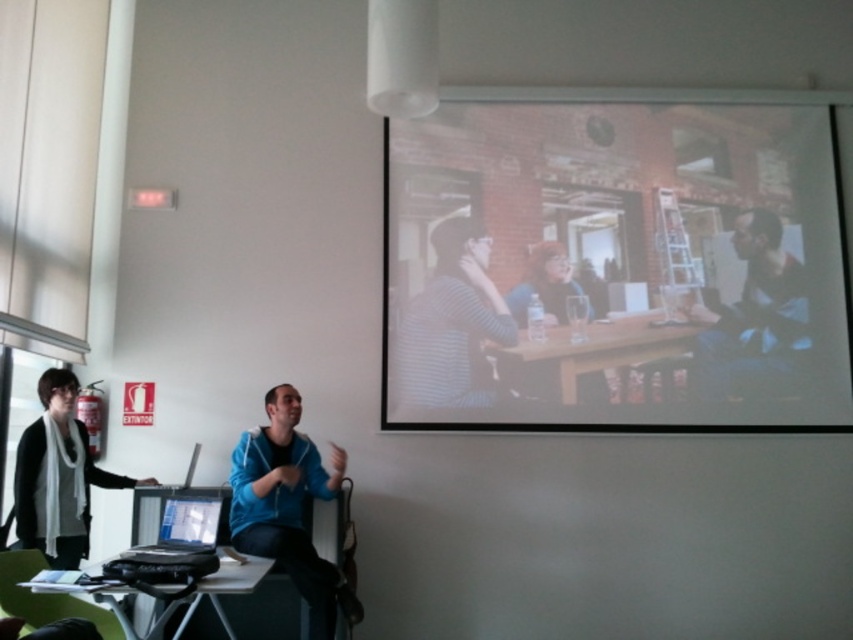
Question: Can you confirm if matte black shirt at center is positioned to the left of black matte laptop at lower left?

Choices:
 (A) yes
 (B) no

Answer: (B)

Question: Which point is closer to the camera?

Choices:
 (A) matte black shirt at center
 (B) blue zip-up jacket at center
 (C) black plastic table at lower left

Answer: (C)

Question: Is wooden table at center below silver metallic laptop at lower left?

Choices:
 (A) yes
 (B) no

Answer: (B)

Question: Which of the following is the closest to the observer?

Choices:
 (A) matte black shirt at center
 (B) matte plastic laptop at lower left
 (C) white scarf at left
 (D) striped fabric at center

Answer: (B)

Question: Considering the relative positions of matte white projector screen at upper center and striped fabric at center in the image provided, where is matte white projector screen at upper center located with respect to striped fabric at center?

Choices:
 (A) below
 (B) above

Answer: (B)

Question: Considering the real-world distances, which object is closest to the dark blue shirt at upper right?

Choices:
 (A) black matte laptop at lower left
 (B) white scarf at left

Answer: (A)